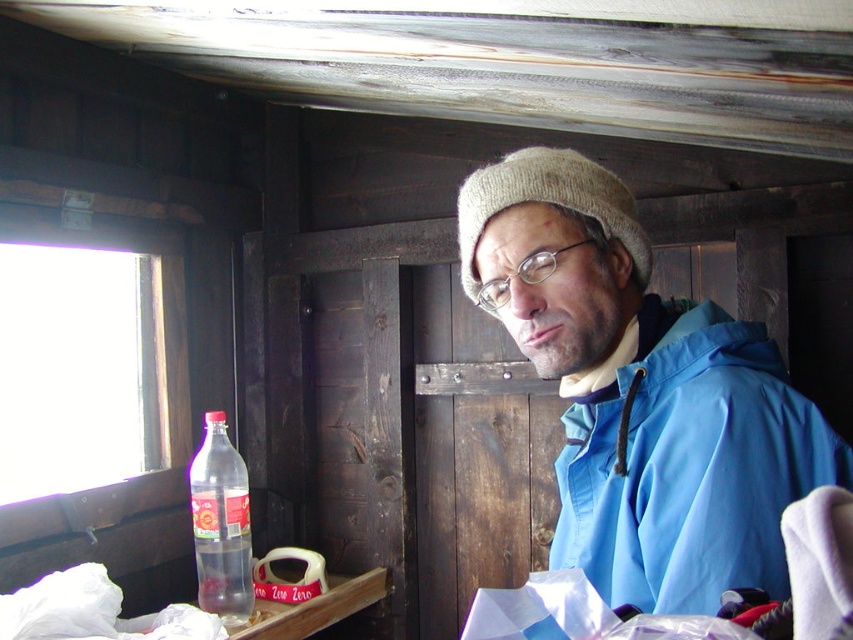
Question: Among these objects, which one is farthest from the camera?

Choices:
 (A) blue fabric jacket at center
 (B) knitted beige hat at upper center
 (C) translucent plastic bottle at lower left

Answer: (C)

Question: Can you confirm if blue fabric jacket at center is positioned below translucent plastic bottle at lower left?

Choices:
 (A) yes
 (B) no

Answer: (B)

Question: Does blue fabric jacket at center lie in front of translucent plastic bottle at lower left?

Choices:
 (A) yes
 (B) no

Answer: (A)

Question: Which object is closer to the camera taking this photo?

Choices:
 (A) knitted beige hat at upper center
 (B) translucent plastic bottle at lower left

Answer: (A)

Question: Which object appears farthest from the camera in this image?

Choices:
 (A) blue fabric jacket at center
 (B) translucent plastic bottle at lower left

Answer: (B)

Question: Is knitted beige hat at upper center smaller than translucent plastic bottle at lower left?

Choices:
 (A) yes
 (B) no

Answer: (A)